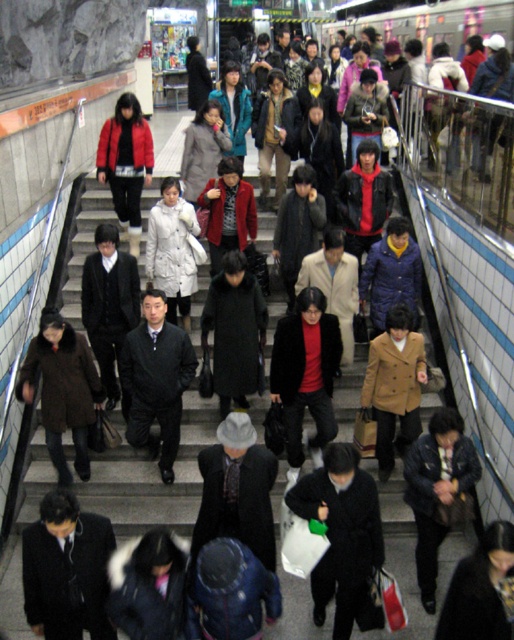
Based on the photo, between black matte suit at center and brown leather coat at center, which one is positioned higher?

Positioned higher is brown leather coat at center.

Locate an element on the screen. black matte suit at center is located at coordinates (66, 570).

Image resolution: width=514 pixels, height=640 pixels. Find the location of `black matte suit at center`. black matte suit at center is located at coordinates (66, 570).

Which is more to the left, brown leather coat at center or black wool coat at center?

brown leather coat at center is more to the left.

Does brown leather coat at center appear under black wool coat at center?

Yes.

This screenshot has width=514, height=640. I want to click on brown leather coat at center, so click(x=63, y=388).

Which is more to the right, black fabric coat at center or black wool coat at center?

black fabric coat at center is more to the right.

This screenshot has width=514, height=640. Describe the element at coordinates (340, 532) in the screenshot. I see `black fabric coat at center` at that location.

Locate an element on the screen. This screenshot has height=640, width=514. black fabric coat at center is located at coordinates (340, 532).